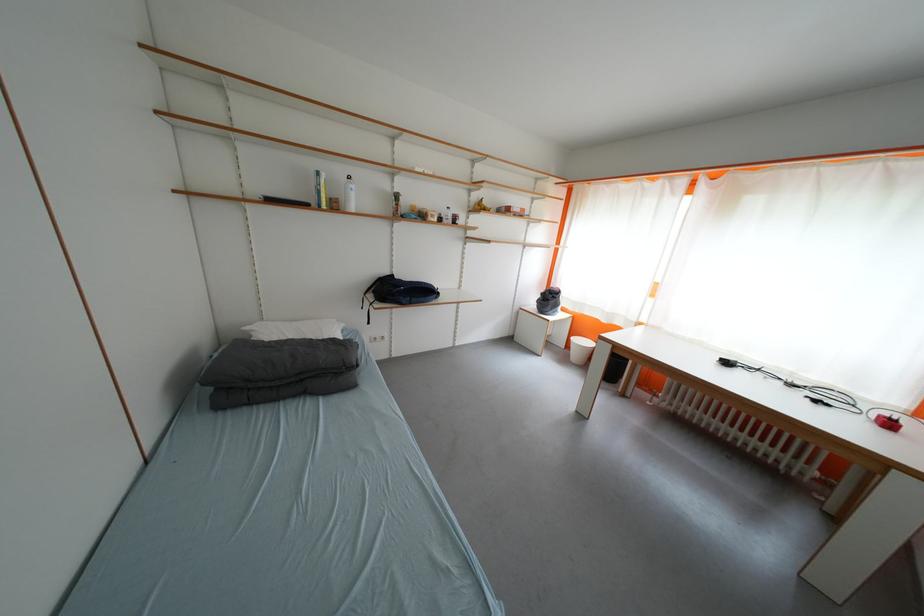
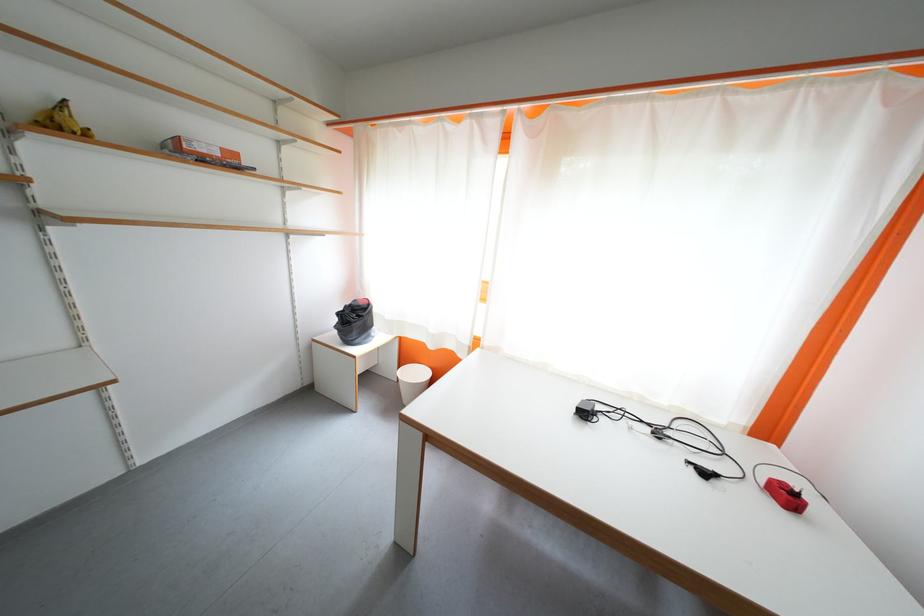
Find the pixel in the second image that matches the point at 825,405 in the first image.

(713, 477)